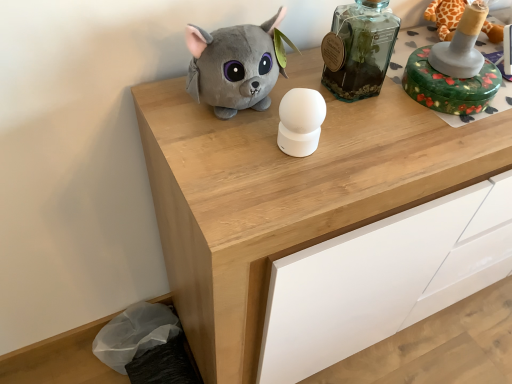
Question: Should I look upward or downward to see green floral-patterned box at upper right, which is counted as the second toy, starting from the left?

Choices:
 (A) down
 (B) up

Answer: (B)

Question: Is transparent glass bottle at upper center to the left of green floral-patterned box at upper right, the 1th toy when ordered from right to left, from the viewer's perspective?

Choices:
 (A) yes
 (B) no

Answer: (A)

Question: Is transparent glass bottle at upper center smaller than green floral-patterned box at upper right, the 1th toy when ordered from right to left?

Choices:
 (A) yes
 (B) no

Answer: (A)

Question: Does transparent glass bottle at upper center have a larger size compared to green floral-patterned box at upper right, the 1th toy when ordered from right to left?

Choices:
 (A) yes
 (B) no

Answer: (B)

Question: Does transparent glass bottle at upper center lie in front of green floral-patterned box at upper right, the 1th toy when ordered from right to left?

Choices:
 (A) yes
 (B) no

Answer: (A)

Question: Does transparent glass bottle at upper center have a greater width compared to green floral-patterned box at upper right, the 1th toy when ordered from right to left?

Choices:
 (A) yes
 (B) no

Answer: (B)

Question: Is transparent glass bottle at upper center positioned beyond the bounds of green floral-patterned box at upper right, which is counted as the second toy, starting from the left?

Choices:
 (A) yes
 (B) no

Answer: (A)

Question: Is the surface of green floral-patterned box at upper right, which is counted as the second toy, starting from the left, in direct contact with transparent glass bottle at upper center?

Choices:
 (A) yes
 (B) no

Answer: (B)

Question: Is the position of green floral-patterned box at upper right, the 1th toy when ordered from right to left, more distant than that of transparent glass bottle at upper center?

Choices:
 (A) yes
 (B) no

Answer: (A)

Question: Is green floral-patterned box at upper right, which is counted as the second toy, starting from the left, taller than transparent glass bottle at upper center?

Choices:
 (A) yes
 (B) no

Answer: (B)

Question: Considering the relative sizes of green floral-patterned box at upper right, which is counted as the second toy, starting from the left, and transparent glass bottle at upper center in the image provided, is green floral-patterned box at upper right, which is counted as the second toy, starting from the left, smaller than transparent glass bottle at upper center?

Choices:
 (A) no
 (B) yes

Answer: (A)

Question: Considering the relative sizes of green floral-patterned box at upper right, the 1th toy when ordered from right to left, and transparent glass bottle at upper center in the image provided, is green floral-patterned box at upper right, the 1th toy when ordered from right to left, thinner than transparent glass bottle at upper center?

Choices:
 (A) no
 (B) yes

Answer: (A)

Question: Considering the relative sizes of green floral-patterned box at upper right, the 1th toy when ordered from right to left, and transparent glass bottle at upper center in the image provided, is green floral-patterned box at upper right, the 1th toy when ordered from right to left, bigger than transparent glass bottle at upper center?

Choices:
 (A) yes
 (B) no

Answer: (A)

Question: Could you tell me if wooden chest of drawers at center is facing transparent glass bottle at upper center?

Choices:
 (A) yes
 (B) no

Answer: (B)